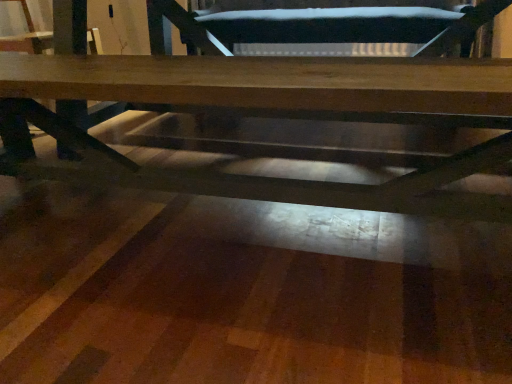
You are a GUI agent. You are given a task and a screenshot of the screen. Output one action in this format:
    pyautogui.click(x=<x>, y=<y>)
    Task: Click on the wooden table at center
    The image size is (512, 384).
    Given the screenshot: What is the action you would take?
    pyautogui.click(x=285, y=113)

Image resolution: width=512 pixels, height=384 pixels. What do you see at coordinates (285, 113) in the screenshot?
I see `wooden table at center` at bounding box center [285, 113].

Find the location of a particular element. This screenshot has height=384, width=512. wooden table at center is located at coordinates [285, 113].